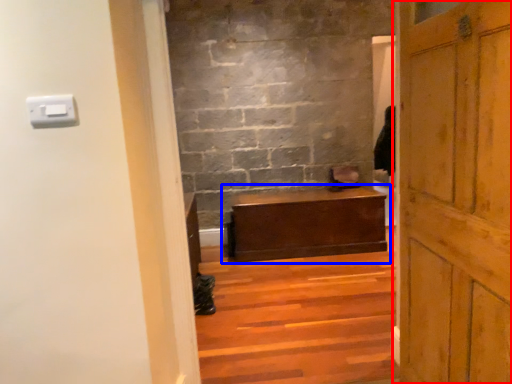
Question: Among these objects, which one is nearest to the camera, door (highlighted by a red box) or table (highlighted by a blue box)?

Choices:
 (A) door
 (B) table

Answer: (A)